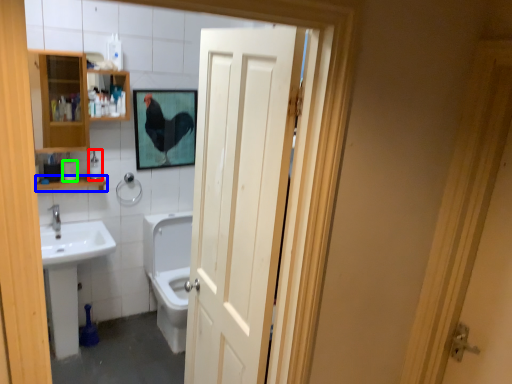
Question: Which is farther away from toiletry (highlighted by a red box)? balustrade (highlighted by a blue box) or toilet paper (highlighted by a green box)?

Choices:
 (A) balustrade
 (B) toilet paper

Answer: (B)